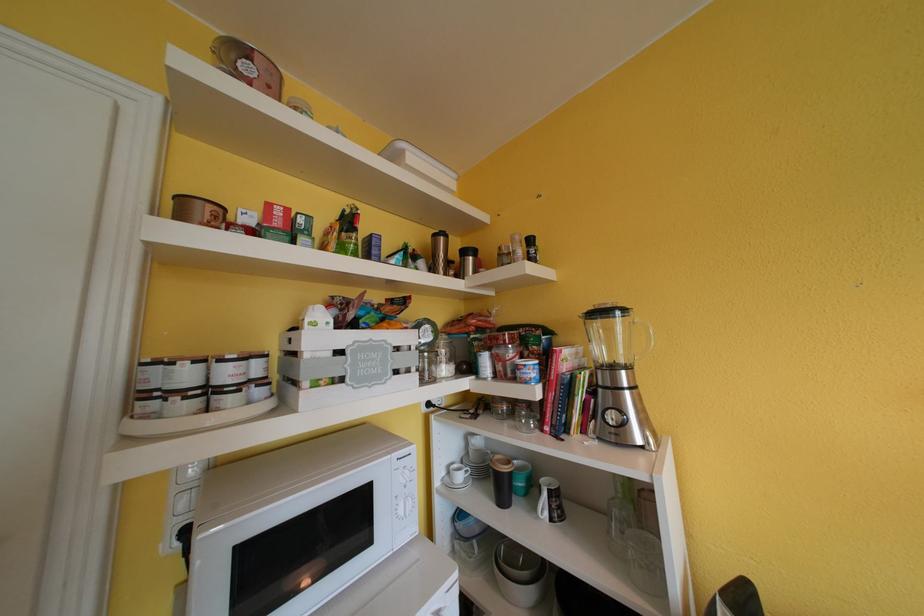
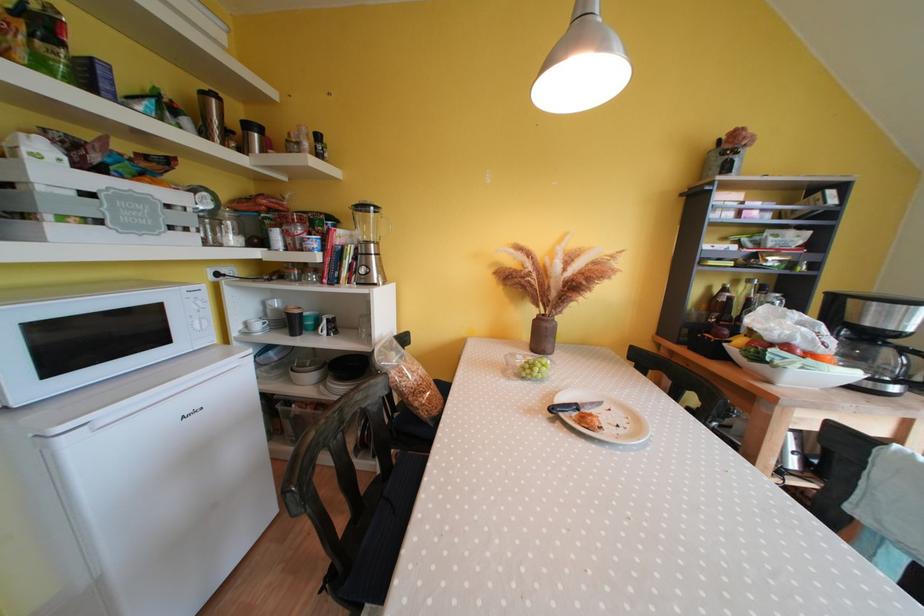
The point at (629,375) is marked in the first image. Where is the corresponding point in the second image?

(379, 249)